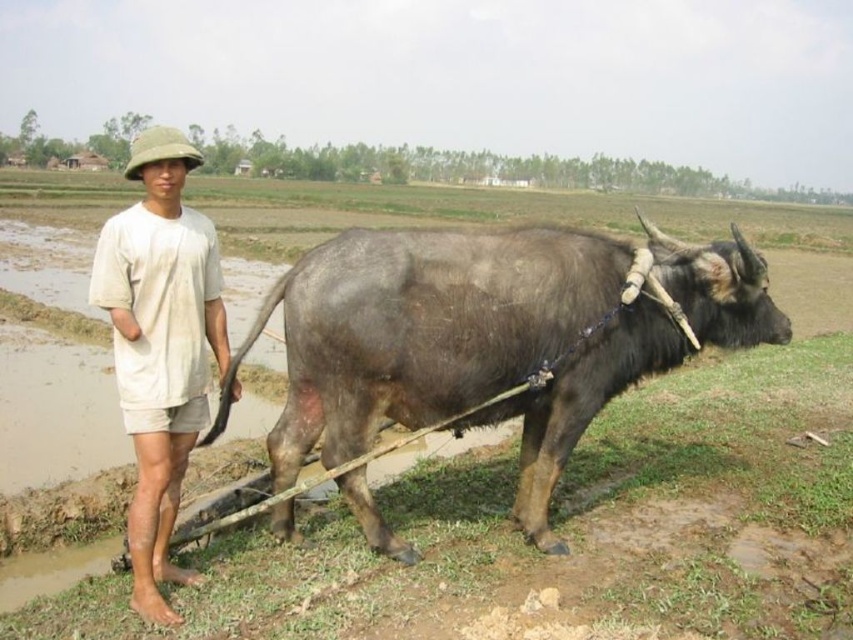
Between dark gray textured bull at right and light beige cotton shirt at left, which one is positioned lower?

light beige cotton shirt at left

Is dark gray textured bull at right wider than light beige cotton shirt at left?

Yes.

Does point (666, 365) come behind point (180, 221)?

Yes.

The width and height of the screenshot is (853, 640). I want to click on dark gray textured bull at right, so click(421, 326).